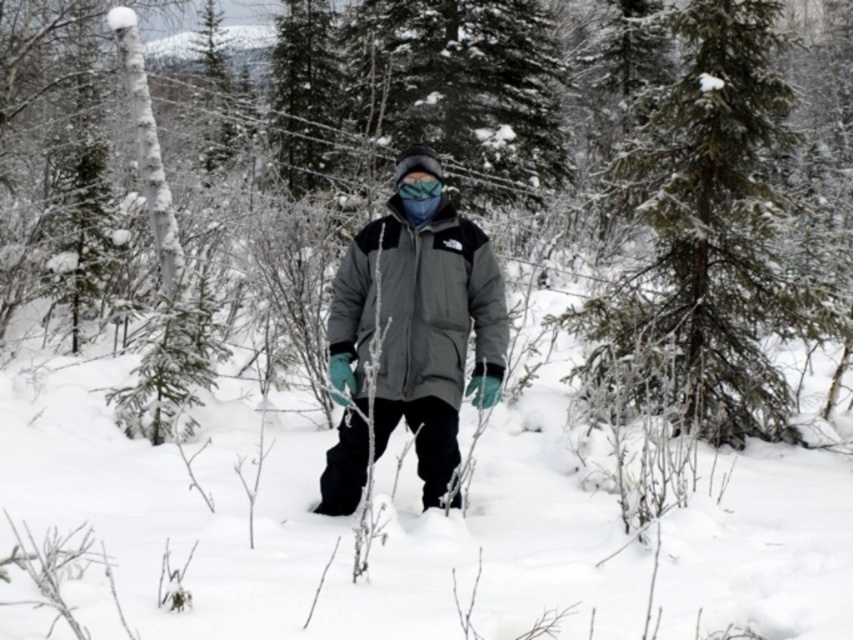
You are a photographer trying to capture a clear shot of the gray matte jacket at center while also including the green textured pine tree at upper right in the background. Based on their positions, will the pine tree appear in the background behind the jacket in the photo?

The green textured pine tree at upper right is positioned over gray matte jacket at center, so yes, the pine tree will appear in the background behind the jacket in the photo.

You are a photographer trying to capture the person in the snowy forest. You need to adjust your camera settings so that both the gray matte jacket at center and the blue fabric goggles at center are in focus. Which object should you focus on first to ensure both are sharp?

The gray matte jacket at center is located below the blue fabric goggles at center. To ensure both are in focus, you should focus on the gray matte jacket at center first, as it is closer to the camera, and then adjust the focus upwards to include the blue fabric goggles at center in the sharp range.

You are a hiker who wants to take a photo of the gray matte jacket at center with the green textured pine tree at upper right in the background. Can you position yourself so that the pine tree is clearly visible behind the jacket?

The green textured pine tree at upper right is 4.09 meters away from the gray matte jacket at center. Since the distance between them is sufficient, you can position yourself in a way that the pine tree is clearly visible behind the jacket.